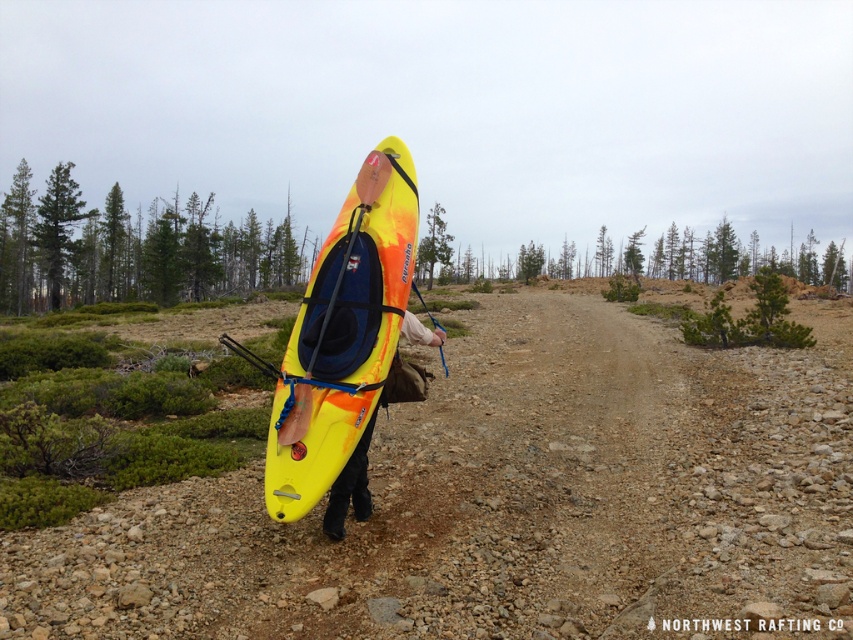
You are a hiker trying to decide which kayak to take for a quick trip. You see a yellow matte kayak at center and a yellow plastic kayak at center. Which one is on the left side?

The yellow matte kayak at center is positioned on the left side of the yellow plastic kayak at center, so the yellow matte kayak at center is on the left.